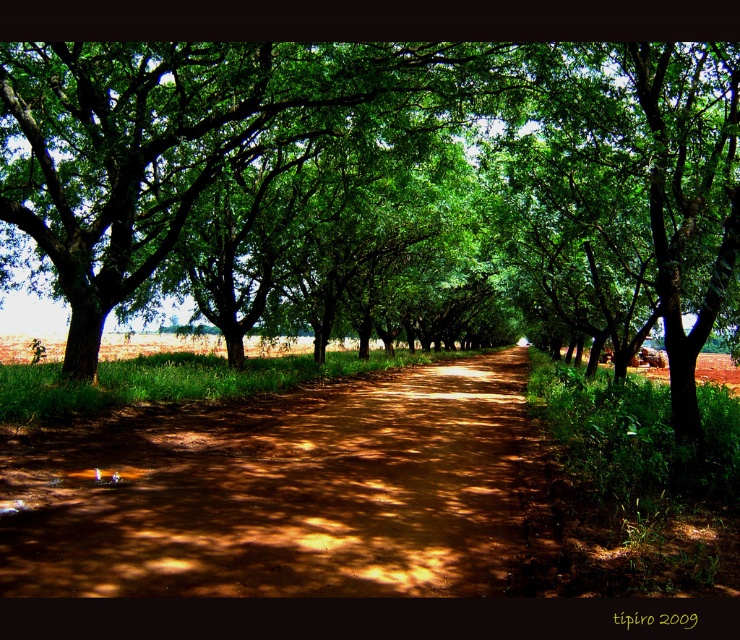
Is point (588, 284) closer to viewer compared to point (477, 429)?

No, (588, 284) is behind (477, 429).

This screenshot has height=640, width=740. Identify the location of green leafy tree at center. (380, 186).